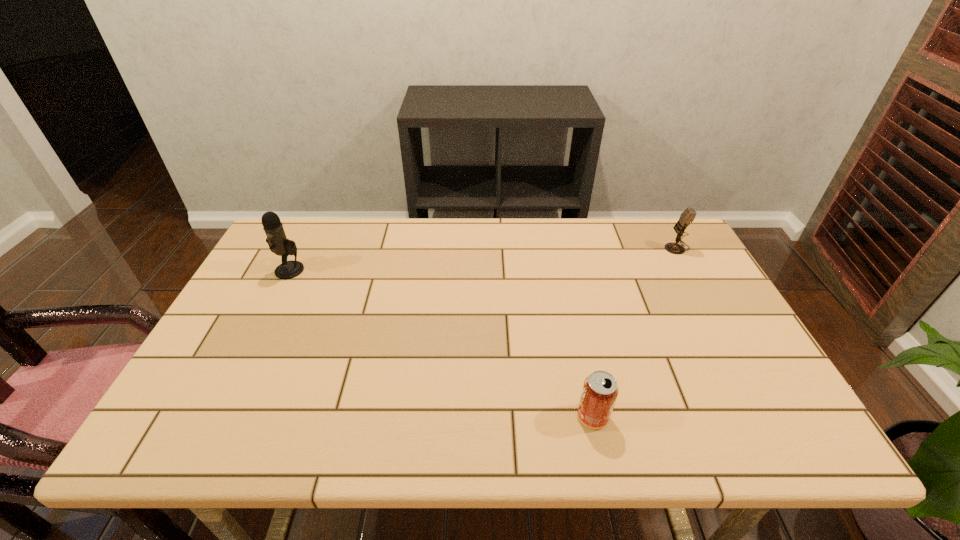
Image resolution: width=960 pixels, height=540 pixels. I want to click on free location located 0.070m on the back of the shortest object, so click(584, 376).

This screenshot has width=960, height=540. Identify the location of object that is positioned at the near edge. (600, 390).

Find the location of a particular element. object that is at the left edge is located at coordinates (278, 243).

Find the location of `object at the right edge`. object at the right edge is located at coordinates (687, 217).

Find the location of a particular element. This screenshot has height=540, width=960. object at the far left corner is located at coordinates (278, 243).

Identify the location of object located at the far right corner. The image size is (960, 540). (687, 217).

The height and width of the screenshot is (540, 960). Identify the location of vacant space at the far edge of the desktop. (496, 240).

In the image, there is a desktop. In order to click on vacant space at the near edge in this screenshot , I will do `click(561, 415)`.

In the image, there is a desktop. Identify the location of blank space at the right edge. This screenshot has height=540, width=960. (736, 383).

This screenshot has height=540, width=960. What are the coordinates of `vacant space at the far left corner of the desktop` in the screenshot? It's located at (314, 249).